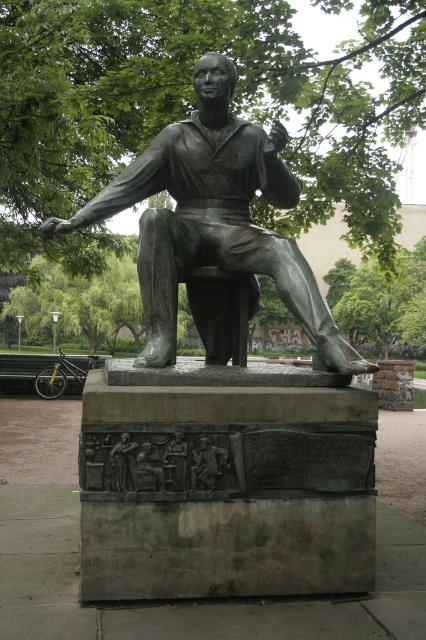
Question: Which of the following is the closest to the observer?

Choices:
 (A) (213, 204)
 (B) (209, 468)
 (C) (109, 472)

Answer: (C)

Question: Which point is closer to the camera?

Choices:
 (A) (221, 161)
 (B) (226, 464)
 (C) (124, 452)

Answer: (C)

Question: Does bronze statue at center have a smaller size compared to bronze relief figure at center?

Choices:
 (A) no
 (B) yes

Answer: (A)

Question: From the image, what is the correct spatial relationship of bronze statue at center in relation to bronze relief figure at lower center?

Choices:
 (A) above
 (B) below

Answer: (A)

Question: Does bronze statue at center have a greater width compared to bronze relief figure at center?

Choices:
 (A) no
 (B) yes

Answer: (B)

Question: Which point appears closest to the camera in this image?

Choices:
 (A) (109, 465)
 (B) (201, 467)

Answer: (A)